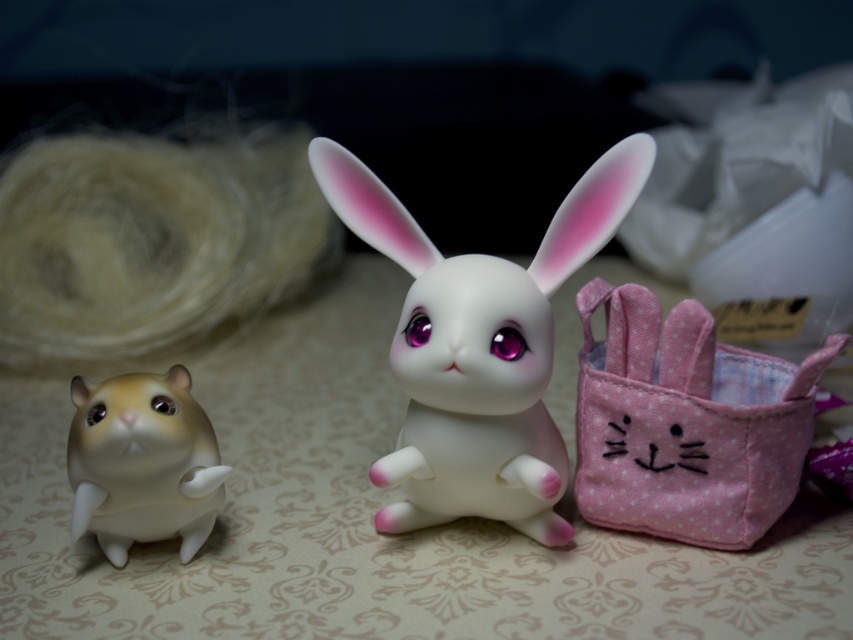
Is the position of white glossy rabbit at center less distant than that of matte white rabbit at center?

That is False.

Who is taller, white glossy rabbit at center or matte white rabbit at center?

white glossy rabbit at center

I want to click on white glossy rabbit at center, so click(x=479, y=348).

Is point (492, 364) positioned after point (801, 448)?

No, it is in front of (801, 448).

Can you confirm if white glossy rabbit at center is shorter than pink fabric basket at right?

No, white glossy rabbit at center is not shorter than pink fabric basket at right.

This screenshot has width=853, height=640. In order to click on white glossy rabbit at center in this screenshot , I will do `click(479, 348)`.

Is pink fabric basket at right above matte white rabbit at center?

Yes, pink fabric basket at right is above matte white rabbit at center.

Who is positioned more to the right, pink fabric basket at right or matte white rabbit at center?

From the viewer's perspective, pink fabric basket at right appears more on the right side.

This screenshot has width=853, height=640. What are the coordinates of `pink fabric basket at right` in the screenshot? It's located at pos(686,422).